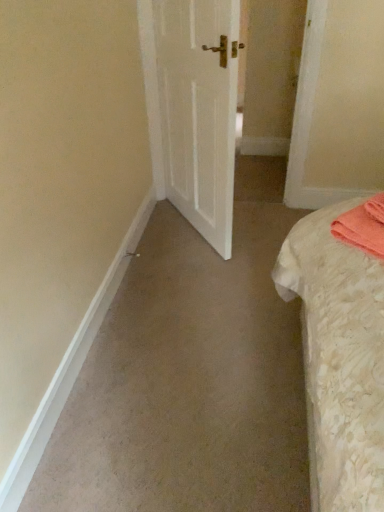
Identify the location of vacant area that is in front of white matte door at center. [200, 284].